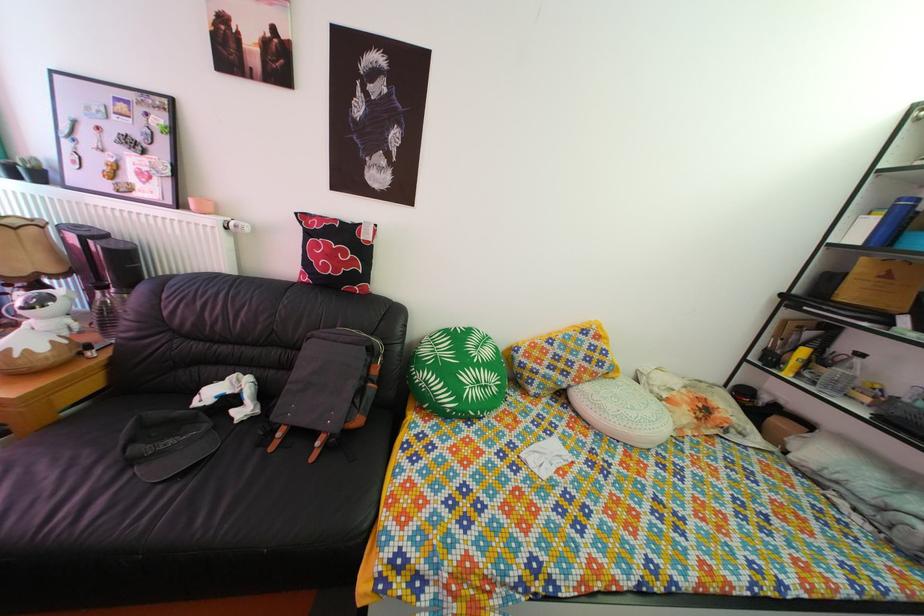
Find where to lift the light green pillow. Please return your answer as a coordinate pair (x, y).

(456, 373)